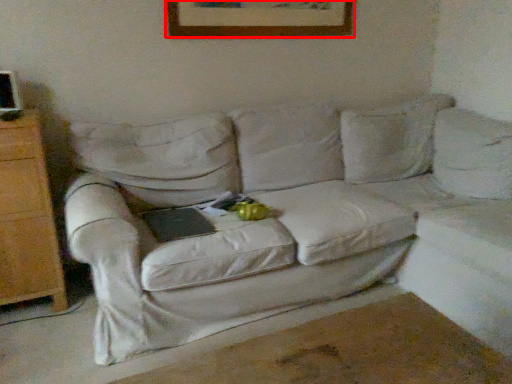
Question: From the image's perspective, where is picture frame (annotated by the red box) located in relation to studio couch in the image?

Choices:
 (A) below
 (B) above

Answer: (B)